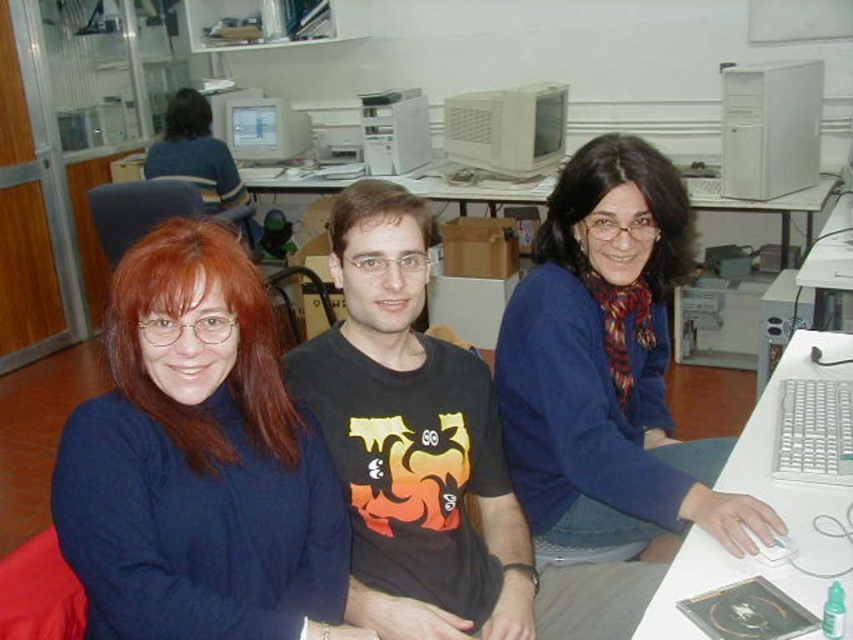
You are standing at the point marked as point (178,461) in the office scene. If you want to take a photo of the three people seated at the desk using a camera that has a 10 feet range, will you be able to capture them all in the frame?

The distance between point (178,461) and the camera is 3.57 feet, which is within the 10 feet range of the camera. Therefore, you can capture the three people seated at the desk in the frame.

In the office scene, there are three people seated at a desk. The person on the left is wearing a blue sweater, the center person has a black T shirt with a face design, and the person on the right wears a blue top with a scarf. A point at coordinates (198, 461) is shown. Which person is closest to this point?

The blue sweater at left is represented by point (198, 461), so the person on the left wearing the blue sweater is closest to this point.